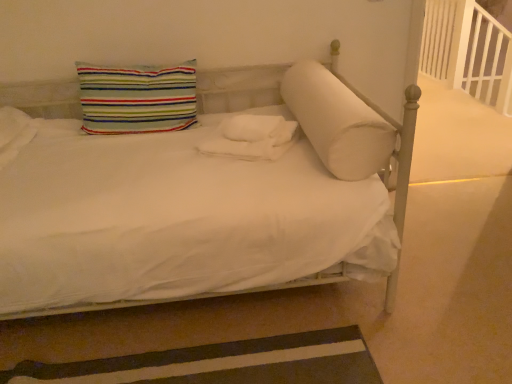
Question: Can you confirm if brown striped rug at lower left is shorter than white fluffy blanket at center?

Choices:
 (A) no
 (B) yes

Answer: (B)

Question: From the image's perspective, is brown striped rug at lower left on white fluffy blanket at center?

Choices:
 (A) no
 (B) yes

Answer: (A)

Question: From a real-world perspective, is brown striped rug at lower left physically above white fluffy blanket at center?

Choices:
 (A) no
 (B) yes

Answer: (A)

Question: Is brown striped rug at lower left smaller than white fluffy blanket at center?

Choices:
 (A) no
 (B) yes

Answer: (B)

Question: From the image's perspective, is brown striped rug at lower left below white fluffy blanket at center?

Choices:
 (A) no
 (B) yes

Answer: (B)

Question: Considering the relative positions of brown striped rug at lower left and white fluffy blanket at center in the image provided, is brown striped rug at lower left behind white fluffy blanket at center?

Choices:
 (A) no
 (B) yes

Answer: (A)

Question: Is striped fabric pillow at upper left, the 2th pillow when ordered from right to left, turned away from white wooden balustrade at upper right?

Choices:
 (A) no
 (B) yes

Answer: (A)

Question: Is striped fabric pillow at upper left, the first pillow from the left, taller than white wooden balustrade at upper right?

Choices:
 (A) yes
 (B) no

Answer: (B)

Question: Can you confirm if striped fabric pillow at upper left, the 2th pillow when ordered from right to left, is wider than white wooden balustrade at upper right?

Choices:
 (A) no
 (B) yes

Answer: (B)

Question: Is white wooden balustrade at upper right a part of striped fabric pillow at upper left, the first pillow from the left?

Choices:
 (A) yes
 (B) no

Answer: (B)

Question: Is striped fabric pillow at upper left, the first pillow from the left, shorter than white wooden balustrade at upper right?

Choices:
 (A) no
 (B) yes

Answer: (B)

Question: Is striped fabric pillow at upper left, the first pillow from the left, further to the viewer compared to white wooden balustrade at upper right?

Choices:
 (A) no
 (B) yes

Answer: (A)

Question: Does white wooden balustrade at upper right appear on the right side of white fluffy blanket at center?

Choices:
 (A) no
 (B) yes

Answer: (B)